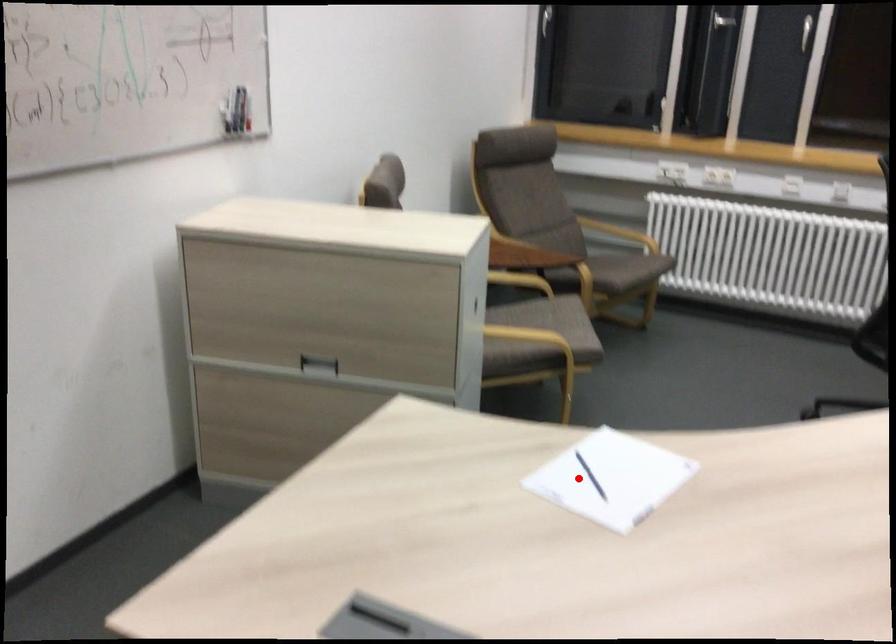
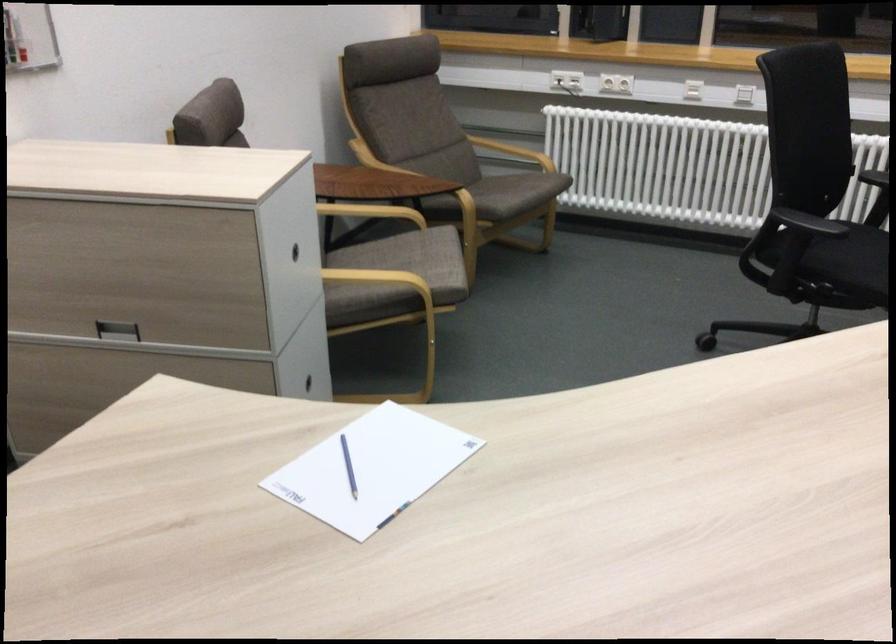
The point at the highlighted location is marked in the first image. Where is the corresponding point in the second image?

(348, 466)